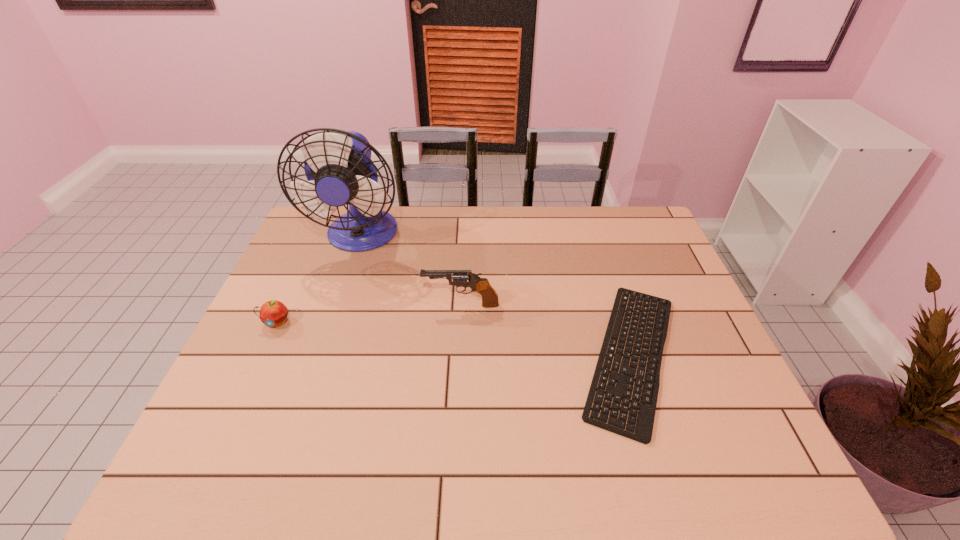
Locate an element on the screen. The height and width of the screenshot is (540, 960). vacant space that satisfies the following two spatial constraints: 1. along the barrel of the second tallest object; 2. in front of the fan where the airflow is directed is located at coordinates (465, 236).

Identify the location of free space in the image that satisfies the following two spatial constraints: 1. in front of the tallest object where the airflow is directed; 2. on the left side of the rightmost object. The image size is (960, 540). (322, 355).

Identify the location of vacant region that satisfies the following two spatial constraints: 1. in front of the farthest object where the airflow is directed; 2. along the barrel of the second tallest object. (338, 305).